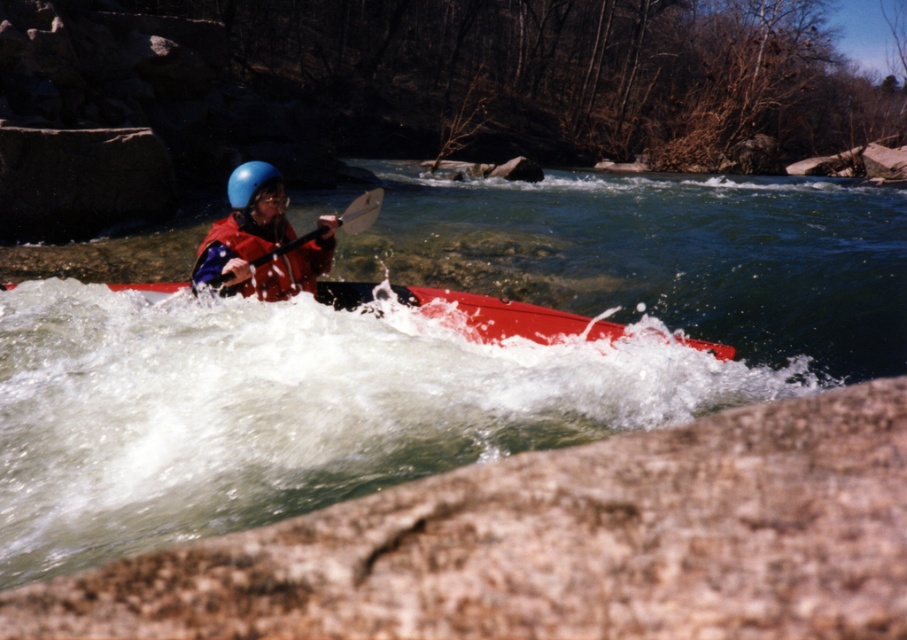
Can you confirm if smooth red canoe at center is wider than black plastic paddle at center?

Yes, smooth red canoe at center is wider than black plastic paddle at center.

Between point (584, 326) and point (374, 205), which one is positioned behind?

The point (374, 205) is more distant.

Between point (523, 316) and point (342, 221), which one is positioned behind?

The point (342, 221) is more distant.

Where is `smooth red canoe at center`? This screenshot has height=640, width=907. smooth red canoe at center is located at coordinates (505, 317).

Who is lower down, smooth water at center or smooth red canoe at center?

Positioned lower is smooth red canoe at center.

The image size is (907, 640). What do you see at coordinates (428, 353) in the screenshot?
I see `smooth water at center` at bounding box center [428, 353].

Is point (57, 372) positioned in front of point (571, 330)?

Yes, it is.

Where is `smooth water at center`? The image size is (907, 640). smooth water at center is located at coordinates (428, 353).

Can you confirm if black plastic paddle at center is positioned above blue matte helmet at center?

Incorrect, black plastic paddle at center is not positioned above blue matte helmet at center.

This screenshot has height=640, width=907. In order to click on black plastic paddle at center in this screenshot , I will do `click(361, 211)`.